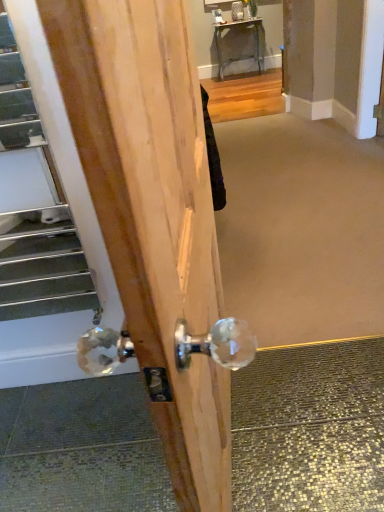
Question: Is clear crystal doorknob at center looking in the opposite direction of metallic silver escalator at lower left?

Choices:
 (A) yes
 (B) no

Answer: (B)

Question: Considering the relative sizes of clear crystal doorknob at center and metallic silver escalator at lower left in the image provided, is clear crystal doorknob at center wider than metallic silver escalator at lower left?

Choices:
 (A) no
 (B) yes

Answer: (B)

Question: From a real-world perspective, does clear crystal doorknob at center stand above metallic silver escalator at lower left?

Choices:
 (A) yes
 (B) no

Answer: (B)

Question: Can you confirm if clear crystal doorknob at center is smaller than metallic silver escalator at lower left?

Choices:
 (A) yes
 (B) no

Answer: (B)

Question: From a real-world perspective, is clear crystal doorknob at center positioned under metallic silver escalator at lower left based on gravity?

Choices:
 (A) yes
 (B) no

Answer: (A)

Question: From the image's perspective, is clear crystal doorknob at center on metallic silver escalator at lower left?

Choices:
 (A) no
 (B) yes

Answer: (A)

Question: Does metallic silver escalator at lower left appear on the left side of metallic silver table at upper center?

Choices:
 (A) yes
 (B) no

Answer: (A)

Question: Can you confirm if metallic silver escalator at lower left is smaller than metallic silver table at upper center?

Choices:
 (A) no
 (B) yes

Answer: (B)

Question: Can you confirm if metallic silver escalator at lower left is taller than metallic silver table at upper center?

Choices:
 (A) yes
 (B) no

Answer: (A)

Question: Does metallic silver escalator at lower left have a lesser width compared to metallic silver table at upper center?

Choices:
 (A) no
 (B) yes

Answer: (B)

Question: Does metallic silver escalator at lower left lie behind metallic silver table at upper center?

Choices:
 (A) no
 (B) yes

Answer: (A)

Question: Is metallic silver escalator at lower left wider than metallic silver table at upper center?

Choices:
 (A) no
 (B) yes

Answer: (A)

Question: Considering the relative sizes of metallic silver escalator at lower left and clear crystal doorknob at center in the image provided, is metallic silver escalator at lower left smaller than clear crystal doorknob at center?

Choices:
 (A) yes
 (B) no

Answer: (A)